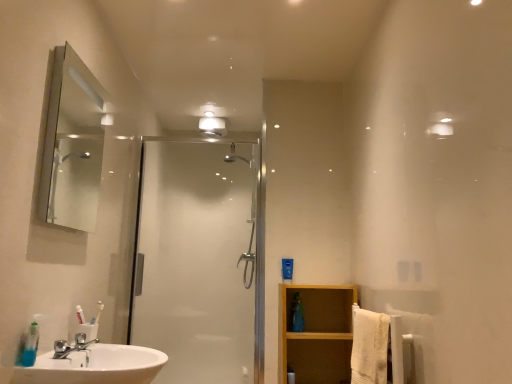
Question: Is white glossy light fixture at upper center to the left or to the right of wooden shelf at lower right in the image?

Choices:
 (A) left
 (B) right

Answer: (A)

Question: In the image, is white glossy light fixture at upper center positioned in front of or behind wooden shelf at lower right?

Choices:
 (A) front
 (B) behind

Answer: (B)

Question: Which of these objects is positioned closest to the clear glass shower door at center?

Choices:
 (A) wooden shelf at lower right
 (B) matte silver mirror at upper left
 (C) white textured towel at right
 (D) white glossy light fixture at upper center

Answer: (A)

Question: Considering the real-world distances, which object is farthest from the clear glass shower door at center?

Choices:
 (A) white textured towel at right
 (B) wooden shelf at lower right
 (C) white glossy light fixture at upper center
 (D) matte silver mirror at upper left

Answer: (A)